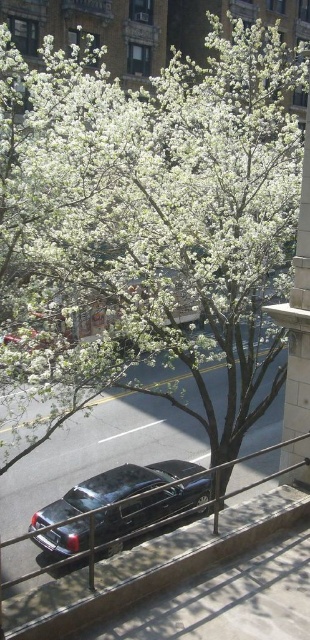
Question: Is metallic gray rail at lower center positioned behind shiny black car at center?

Choices:
 (A) yes
 (B) no

Answer: (B)

Question: Which point appears farthest from the camera in this image?

Choices:
 (A) (266, 528)
 (B) (67, 493)

Answer: (B)

Question: Is metallic gray rail at lower center to the left of shiny black car at center from the viewer's perspective?

Choices:
 (A) yes
 (B) no

Answer: (B)

Question: Is metallic gray rail at lower center bigger than shiny black car at center?

Choices:
 (A) no
 (B) yes

Answer: (A)